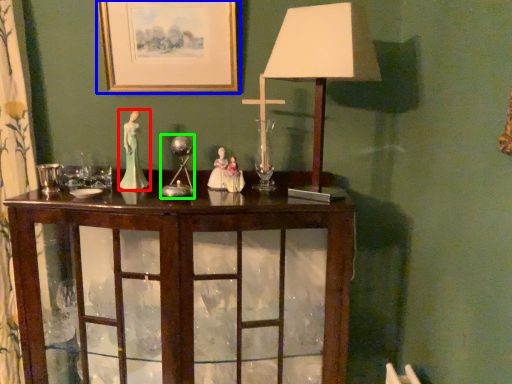
Question: Estimate the real-world distances between objects in this image. Which object is closer to person (highlighted by a red box), picture frame (highlighted by a blue box) or candle holder (highlighted by a green box)?

Choices:
 (A) picture frame
 (B) candle holder

Answer: (B)